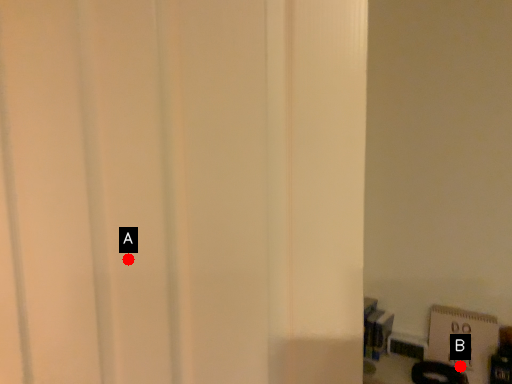
Question: Two points are circled on the image, labeled by A and B beside each circle. Which point appears closest to the camera in this image?

Choices:
 (A) A is closer
 (B) B is closer

Answer: (A)